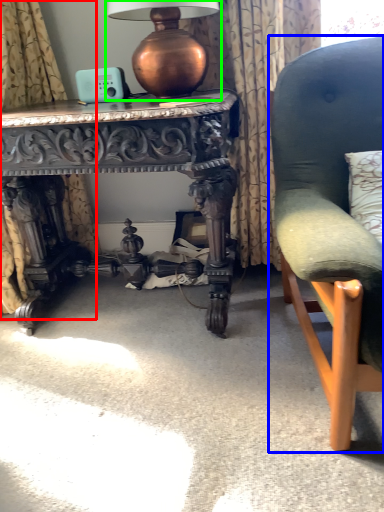
Question: Based on their relative distances, which object is nearer to curtain (highlighted by a red box)? Choose from chair (highlighted by a blue box) and table lamp (highlighted by a green box).

Choices:
 (A) chair
 (B) table lamp

Answer: (B)